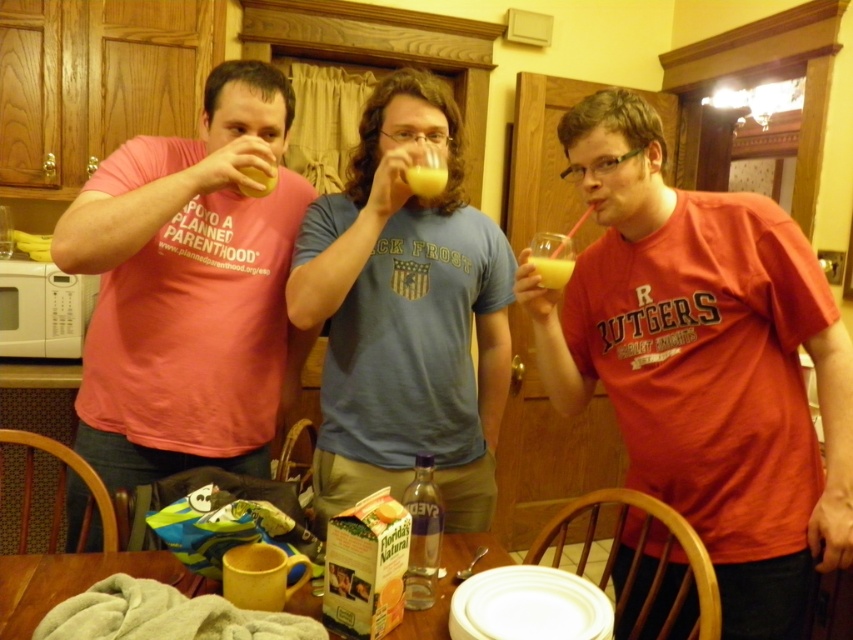
You are a bartender who needs to pour more of the yellow translucent liquid at center into the translucent glass at center. Can you determine if the glass will overflow when you fill it to the brim?

The yellow translucent liquid at center has a lesser width compared to the translucent glass at center, so there is still space in the glass. You can pour more without overflowing.